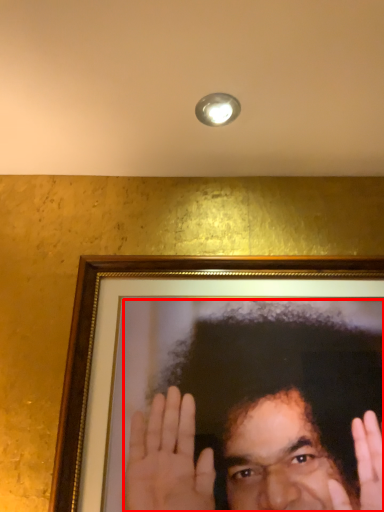
Question: From the image's perspective, what is the correct spatial positioning of man (annotated by the red box) in reference to light fixture?

Choices:
 (A) below
 (B) above

Answer: (A)